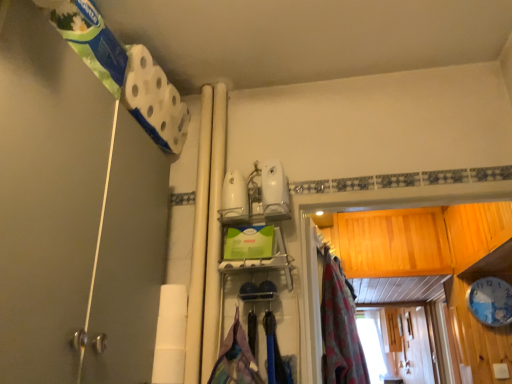
Question: From a real-world perspective, is white matte shower door at left on top of floral fabric curtain at center?

Choices:
 (A) yes
 (B) no

Answer: (A)

Question: Considering the relative sizes of white matte shower door at left and floral fabric curtain at center in the image provided, is white matte shower door at left thinner than floral fabric curtain at center?

Choices:
 (A) no
 (B) yes

Answer: (A)

Question: From the image's perspective, would you say white matte shower door at left is shown under floral fabric curtain at center?

Choices:
 (A) no
 (B) yes

Answer: (A)

Question: Considering the relative sizes of white matte shower door at left and floral fabric curtain at center in the image provided, is white matte shower door at left shorter than floral fabric curtain at center?

Choices:
 (A) no
 (B) yes

Answer: (A)

Question: Is the position of white matte shower door at left more distant than that of floral fabric curtain at center?

Choices:
 (A) no
 (B) yes

Answer: (A)

Question: Which is correct: floral fabric curtain at center is inside white matte shower door at left, or outside of it?

Choices:
 (A) outside
 (B) inside

Answer: (A)

Question: From the image's perspective, is floral fabric curtain at center above or below white matte shower door at left?

Choices:
 (A) above
 (B) below

Answer: (B)

Question: Does point (351, 360) appear closer or farther from the camera than point (46, 225)?

Choices:
 (A) farther
 (B) closer

Answer: (A)

Question: Considering the positions of floral fabric curtain at center and white matte shower door at left in the image, is floral fabric curtain at center bigger or smaller than white matte shower door at left?

Choices:
 (A) small
 (B) big

Answer: (A)

Question: Which is correct: floral fabric curtain at center is inside textured fabric laundry at center, or outside of it?

Choices:
 (A) inside
 (B) outside

Answer: (B)

Question: From the image's perspective, is floral fabric curtain at center positioned above or below textured fabric laundry at center?

Choices:
 (A) above
 (B) below

Answer: (A)

Question: Does point (326, 350) appear closer or farther from the camera than point (283, 372)?

Choices:
 (A) closer
 (B) farther

Answer: (B)

Question: Considering the positions of floral fabric curtain at center and textured fabric laundry at center in the image, is floral fabric curtain at center taller or shorter than textured fabric laundry at center?

Choices:
 (A) short
 (B) tall

Answer: (B)

Question: Is textured fabric laundry at center bigger or smaller than floral fabric curtain at center?

Choices:
 (A) big
 (B) small

Answer: (B)

Question: In terms of height, does textured fabric laundry at center look taller or shorter compared to floral fabric curtain at center?

Choices:
 (A) short
 (B) tall

Answer: (A)